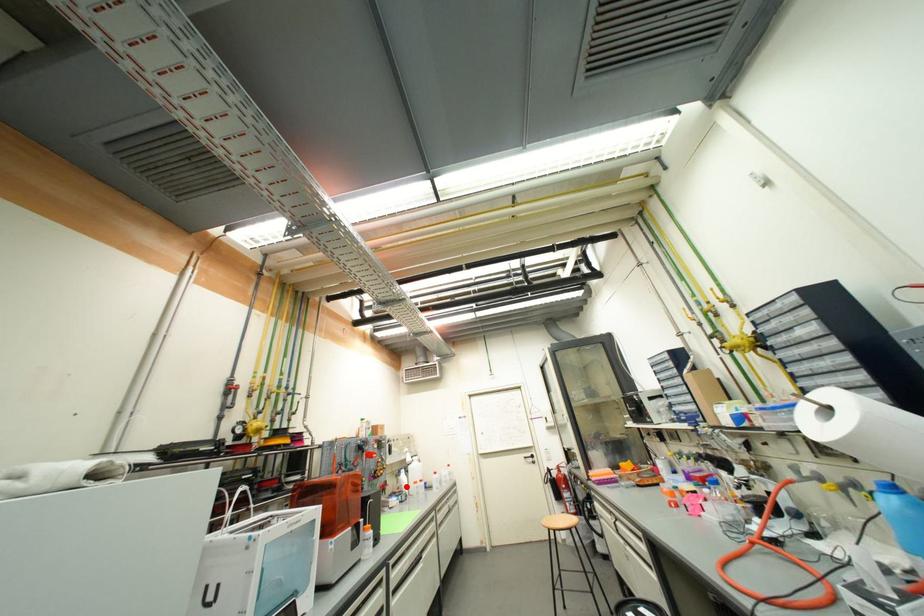
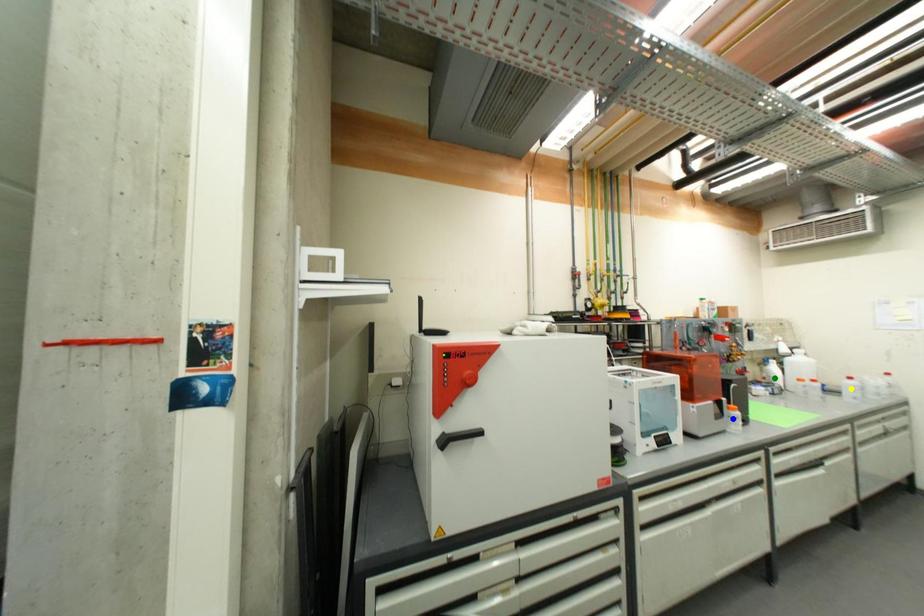
Question: I am providing you with two images of the same scene from different viewpoints. A red point is marked on the first image. You are given multiple points on the second image. Which point in image 2 represents the same 3d spot as the red point in image 1?

Choices:
 (A) yellow point
 (B) blue point
 (C) green point

Answer: (C)